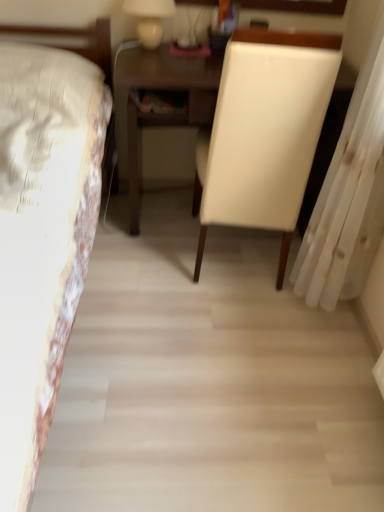
Question: Can you confirm if matte white lamp at upper center is positioned to the right of white leather chair at center?

Choices:
 (A) no
 (B) yes

Answer: (A)

Question: Is matte white lamp at upper center placed right next to white leather chair at center?

Choices:
 (A) yes
 (B) no

Answer: (B)

Question: Considering the relative sizes of matte white lamp at upper center and white leather chair at center in the image provided, is matte white lamp at upper center thinner than white leather chair at center?

Choices:
 (A) yes
 (B) no

Answer: (A)

Question: Considering the relative positions of matte white lamp at upper center and white leather chair at center in the image provided, is matte white lamp at upper center in front of white leather chair at center?

Choices:
 (A) no
 (B) yes

Answer: (A)

Question: Is matte white lamp at upper center oriented towards white leather chair at center?

Choices:
 (A) yes
 (B) no

Answer: (B)

Question: From the image's perspective, is white sheer curtain at right above or below matte white lamp at upper center?

Choices:
 (A) above
 (B) below

Answer: (B)

Question: From a real-world perspective, is white sheer curtain at right physically located above or below matte white lamp at upper center?

Choices:
 (A) above
 (B) below

Answer: (B)

Question: Considering the relative positions of white sheer curtain at right and matte white lamp at upper center in the image provided, is white sheer curtain at right to the left or to the right of matte white lamp at upper center?

Choices:
 (A) right
 (B) left

Answer: (A)

Question: Looking at their shapes, would you say white sheer curtain at right is wider or thinner than matte white lamp at upper center?

Choices:
 (A) wide
 (B) thin

Answer: (A)

Question: Considering the positions of white leather chair at center and white floral fabric bed at left in the image, is white leather chair at center bigger or smaller than white floral fabric bed at left?

Choices:
 (A) big
 (B) small

Answer: (B)

Question: In terms of width, does white leather chair at center look wider or thinner when compared to white floral fabric bed at left?

Choices:
 (A) wide
 (B) thin

Answer: (B)

Question: From the image's perspective, is white leather chair at center above or below white floral fabric bed at left?

Choices:
 (A) below
 (B) above

Answer: (B)

Question: Is point (261, 159) positioned closer to the camera than point (6, 211)?

Choices:
 (A) farther
 (B) closer

Answer: (A)

Question: Considering the positions of point (276, 93) and point (331, 258), is point (276, 93) closer or farther from the camera than point (331, 258)?

Choices:
 (A) closer
 (B) farther

Answer: (A)

Question: Is white leather chair at center spatially inside white sheer curtain at right, or outside of it?

Choices:
 (A) inside
 (B) outside

Answer: (B)